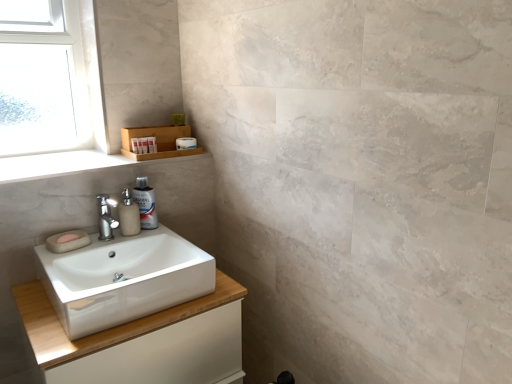
The image size is (512, 384). I want to click on free location to the left of white matte tube at upper left, placed as the 1th toiletry when sorted from back to front, so click(x=95, y=157).